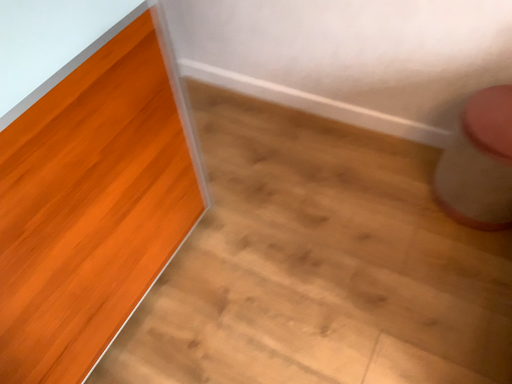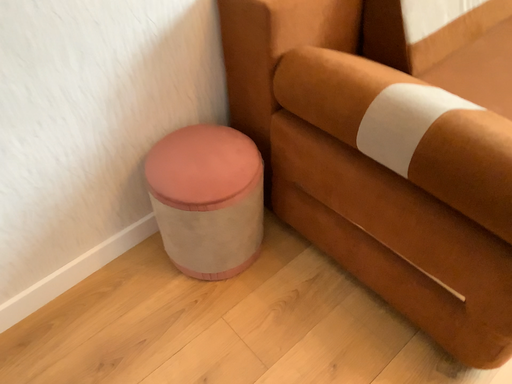
Question: Which way did the camera rotate in the video?

Choices:
 (A) rotated upward
 (B) rotated downward

Answer: (A)